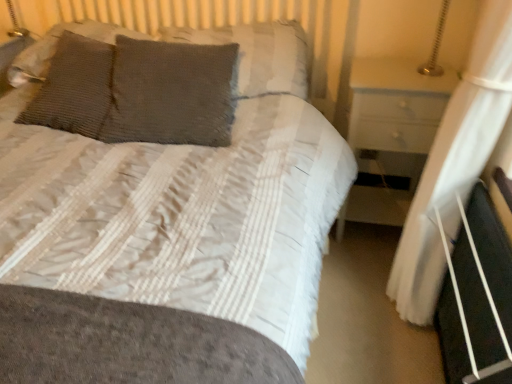
Question: Looking at their shapes, would you say gray textured pillow at center, positioned as the 1th pillow in right-to-left order, is wider or thinner than white sheer curtain at right?

Choices:
 (A) thin
 (B) wide

Answer: (B)

Question: From a real-world perspective, is gray textured pillow at center, positioned as the 1th pillow in right-to-left order, above or below white sheer curtain at right?

Choices:
 (A) above
 (B) below

Answer: (A)

Question: Based on their relative distances, which object is nearer to the gray knitted pillow at center, which is counted as the third pillow, starting from the left?

Choices:
 (A) textured gray pillow at upper left, the third pillow when ordered from right to left
 (B) textured gray pillow at upper left, the 1th pillow from the left
 (C) black plastic bed frame at lower right
 (D) white sheer curtain at right
 (E) gray textured pillow at center, positioned as the fourth pillow in left-to-right order

Answer: (A)

Question: Considering the real-world distances, which object is closest to the gray knitted pillow at center, positioned as the 2th pillow in right-to-left order?

Choices:
 (A) black plastic bed frame at lower right
 (B) white sheer curtain at right
 (C) textured gray pillow at upper left, positioned as the second pillow in left-to-right order
 (D) gray textured pillow at center, positioned as the fourth pillow in left-to-right order
 (E) textured gray pillow at upper left, the 1th pillow from the left

Answer: (C)